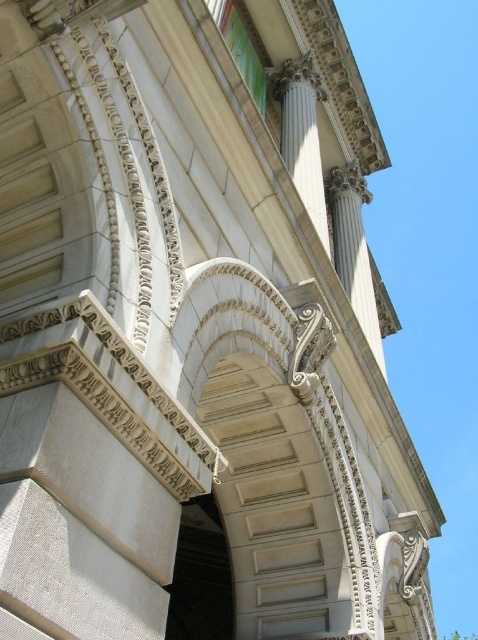
Question: Which point is closer to the camera taking this photo?

Choices:
 (A) (368, 314)
 (B) (314, 154)
 (C) (213, 618)
 (D) (248, 541)

Answer: (D)

Question: Estimate the real-world distances between objects in this image. Which object is farther from the dark gray stone arch at center?

Choices:
 (A) white stone archway at center
 (B) white marble column at center
 (C) white marble column at upper right

Answer: (B)

Question: Among these points, which one is nearest to the camera?

Choices:
 (A) (175, 557)
 (B) (193, 368)
 (C) (282, 113)
 (D) (350, 253)

Answer: (B)

Question: Does dark gray stone arch at center appear under white marble column at upper right?

Choices:
 (A) no
 (B) yes

Answer: (B)

Question: Can you confirm if white stone archway at center is bigger than white marble column at center?

Choices:
 (A) yes
 (B) no

Answer: (B)

Question: Does dark gray stone arch at center appear over white marble column at upper right?

Choices:
 (A) no
 (B) yes

Answer: (A)